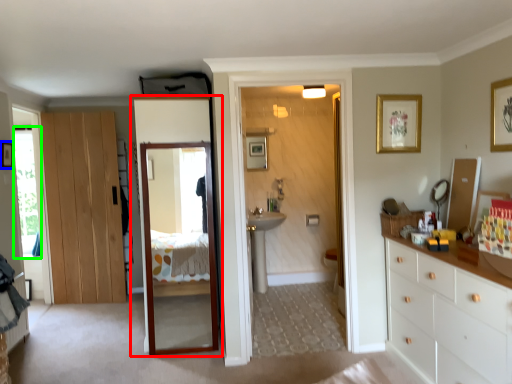
Question: Which object is the farthest from door (highlighted by a red box)? Choose among these: picture frame (highlighted by a blue box) or window (highlighted by a green box).

Choices:
 (A) picture frame
 (B) window

Answer: (A)